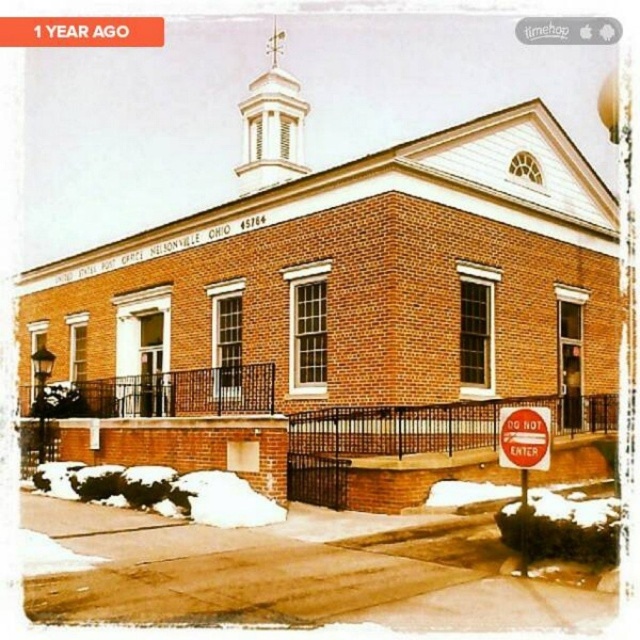
You are standing in front of the brick building in Nelsonville, Ohio. You notice two points marked on the building. The first point is at coordinates point (404, 257) and the second is at point (522, 422). Which point is closer to you?

Point (404, 257) is closer to you because it is further to the viewer than point (522, 422).

You are a delivery person who needs to place a new red plastic sign at lower right that is exactly the same height as the brick building at center. Is this possible?

The brick building at center is taller than the red plastic sign at lower right, so it is not possible to make the new red plastic sign at lower right the same height as the brick building at center.

You are a photographer planning to capture the Nelsonville, Ohio building with both the white smooth spire at upper center and the red plastic sign at lower right in the frame. Which object is wider?

The white smooth spire at upper center is wider than the red plastic sign at lower right according to the description.